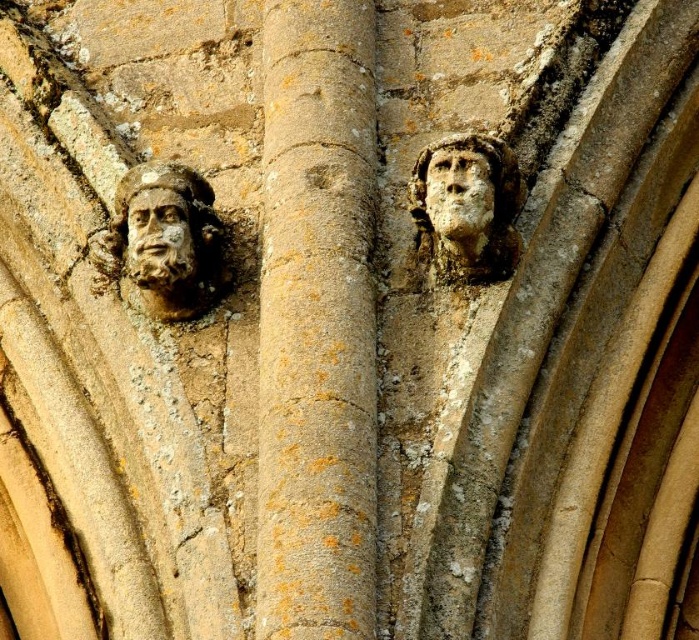
Question: Which of the following is the farthest from the observer?

Choices:
 (A) (164, 209)
 (B) (466, 192)

Answer: (A)

Question: Is brown stone column at center wider than carved stone face at left?

Choices:
 (A) yes
 (B) no

Answer: (A)

Question: Which point is farther from the camera taking this photo?

Choices:
 (A) (475, 208)
 (B) (182, 230)
 (C) (289, 19)

Answer: (C)

Question: From the image, what is the correct spatial relationship of weathered stone face at upper right in relation to carved stone face at left?

Choices:
 (A) below
 (B) above

Answer: (B)

Question: Does brown stone column at center appear on the right side of carved stone face at left?

Choices:
 (A) yes
 (B) no

Answer: (A)

Question: Estimate the real-world distances between objects in this image. Which object is farther from the brown stone column at center?

Choices:
 (A) carved stone face at upper right
 (B) matte stone face at left

Answer: (B)